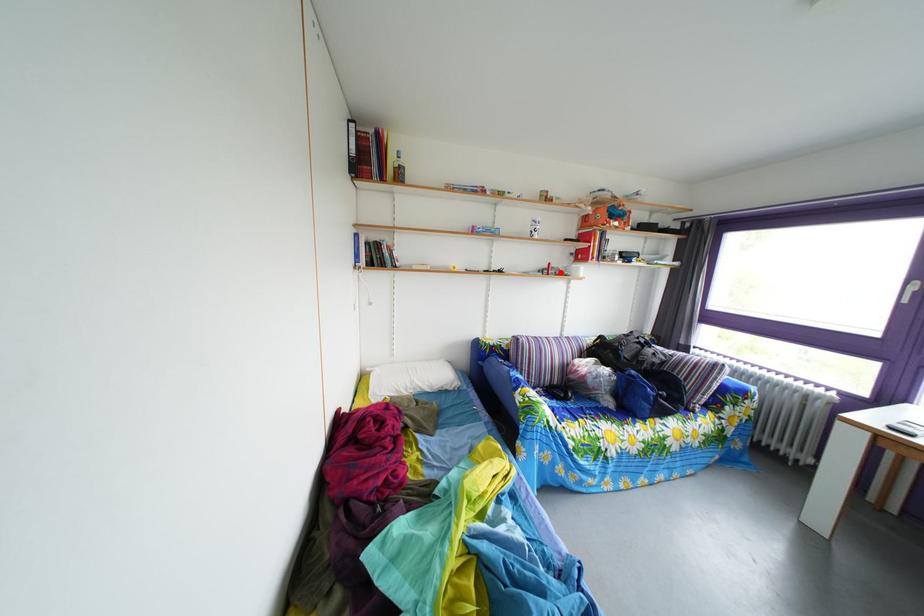
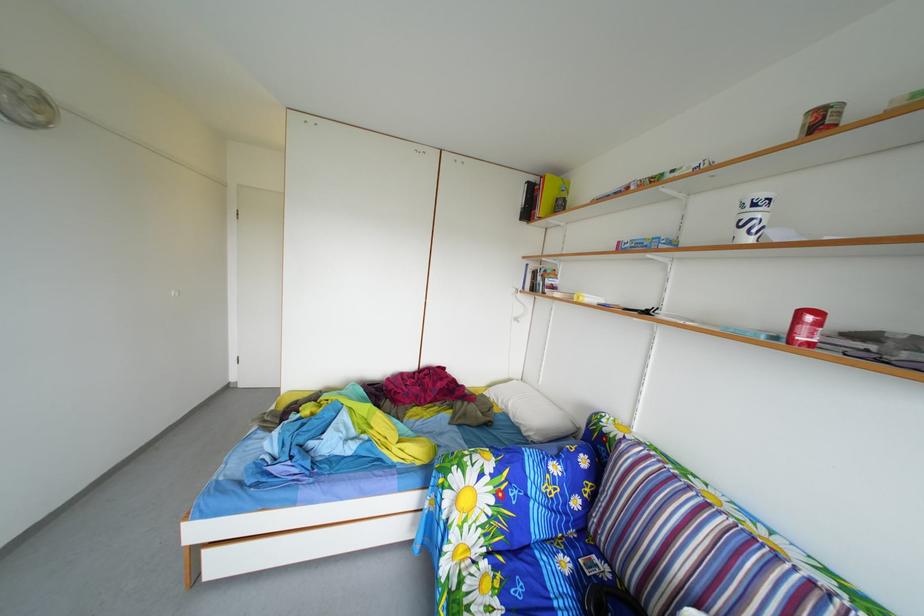
In the second image, find the point that corresponds to the highlighted location in the first image.

(811, 321)